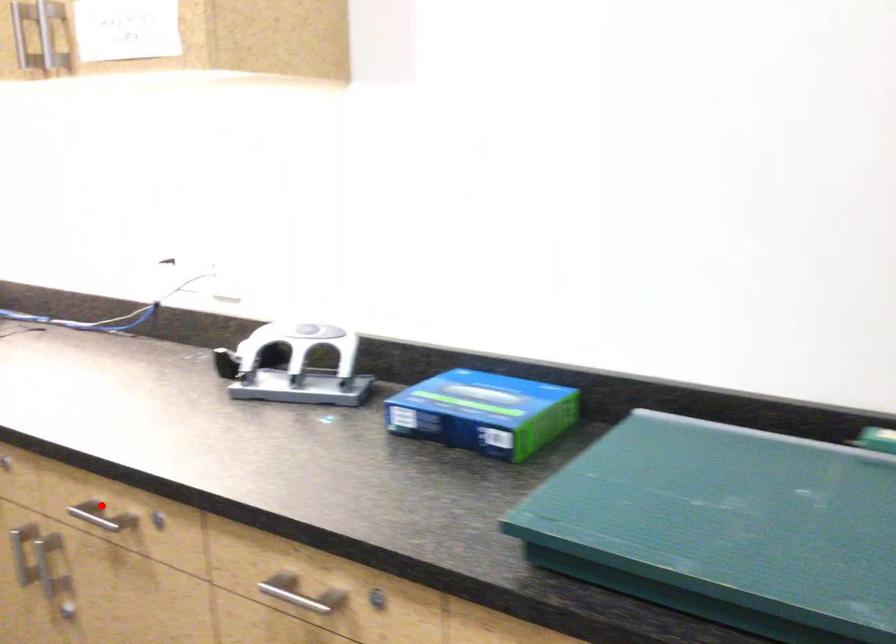
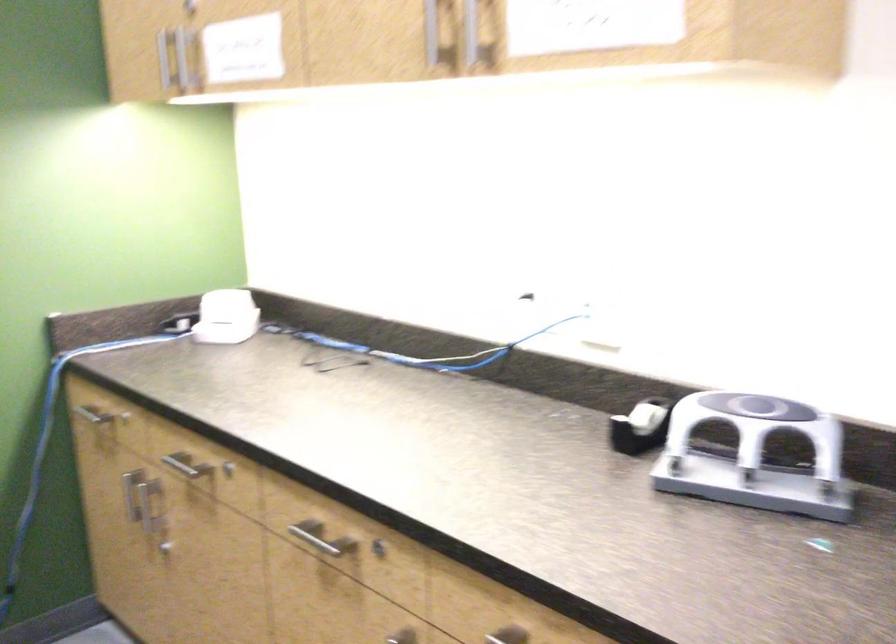
Where in the second image is the point corresponding to the highlighted location from the first image?

(507, 635)